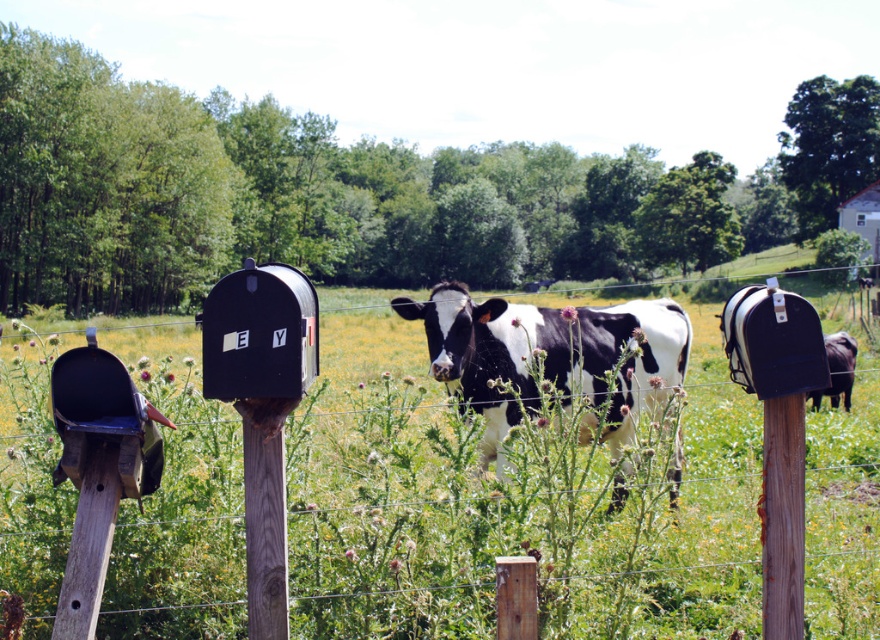
Question: Is black and white spotted cow at center closer to the viewer compared to wooden post at center?

Choices:
 (A) yes
 (B) no

Answer: (B)

Question: Is green grass at center bigger than black matte mailbox at center?

Choices:
 (A) yes
 (B) no

Answer: (A)

Question: Among these points, which one is nearest to the camera?

Choices:
 (A) (587, 342)
 (B) (217, 365)

Answer: (B)

Question: Can you confirm if black matte mailbox at center is positioned below wooden post at center?

Choices:
 (A) no
 (B) yes

Answer: (A)

Question: Based on their relative distances, which object is farther from the wooden post at center?

Choices:
 (A) green grass at center
 (B) black matte mailbox at center
 (C) weathered wood post at center
 (D) black and white spotted cow at center

Answer: (A)

Question: Among these objects, which one is farthest from the camera?

Choices:
 (A) weathered wood post at center
 (B) black and white spotted cow at center
 (C) green grass at center

Answer: (B)